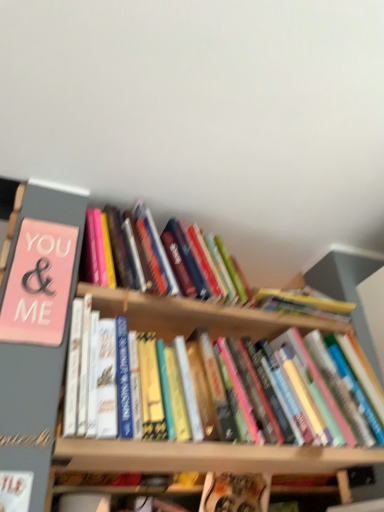
Question: In terms of height, does white paper at lower left, which is the 4th book from top to bottom, look taller or shorter compared to hardcover book at center, which is counted as the 5th book, starting from the bottom?

Choices:
 (A) short
 (B) tall

Answer: (A)

Question: From the image's perspective, relative to hardcover book at center, which is counted as the 5th book, starting from the bottom, is white paper at lower left, which is the 4th book from top to bottom, above or below?

Choices:
 (A) below
 (B) above

Answer: (A)

Question: Which of these objects is positioned closest to the white paper at lower left, which is the 4th book from top to bottom?

Choices:
 (A) pink matte sign at left, the fourth book when ordered from bottom to top
 (B) hardcover book at center, which is counted as the 5th book, starting from the bottom
 (C) hardcover book at center, acting as the 5th book starting from the top
 (D) hardcover book at center, which ranks as the 3th book in top-to-bottom order

Answer: (A)

Question: Considering the real-world distances, which object is closest to the pink matte sign at left, the fourth book when ordered from bottom to top?

Choices:
 (A) hardcover book at center, marked as the 1th book in a top-to-bottom arrangement
 (B) hardcover book at center, the 3th book when ordered from bottom to top
 (C) hardcover book at center, which ranks as the first book in bottom-to-top order
 (D) white paper at lower left, which is the 4th book from top to bottom

Answer: (A)